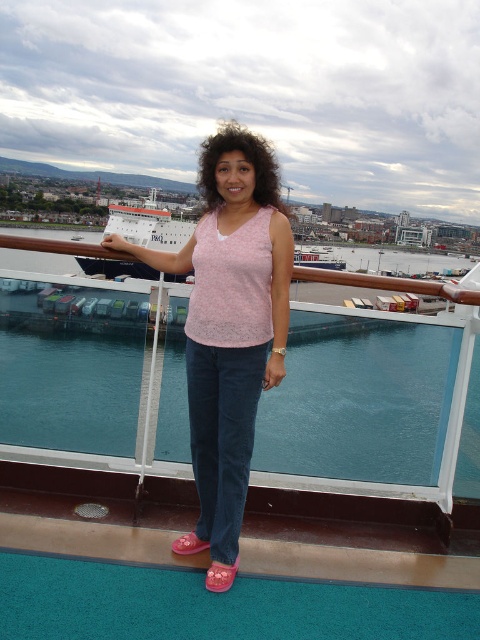
You are a photographer on the ship deck. You need to capture a photo where both the blue water at center and the pink fabric tank top at center are clearly visible. Which object should you focus on first to ensure both are in frame?

The pink fabric tank top at center is larger than the blue water at center, so focusing on the pink fabric tank top at center first will ensure both objects are in frame.

You are a photographer on the deck of the ship. You want to capture a photo that includes both the blue water at center and the white glossy cruise ship at upper left. Which object should appear smaller in the photo?

The blue water at center should appear smaller in the photo because it has a lesser height compared to the white glossy cruise ship at upper left.